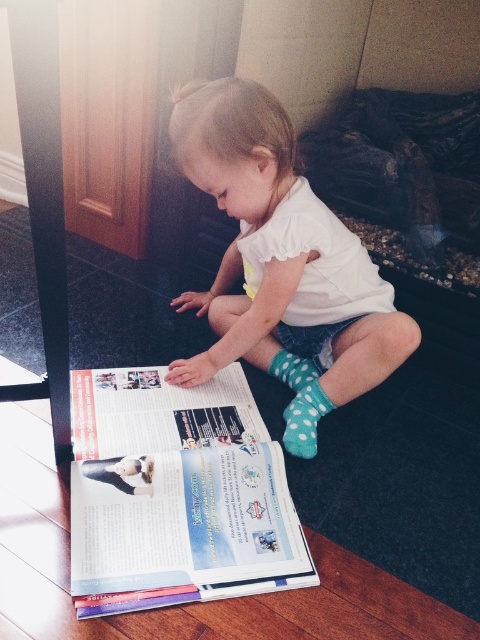
Does white glossy magazine at center have a greater height compared to polka dot fabric sock at lower center?

Yes, white glossy magazine at center is taller than polka dot fabric sock at lower center.

Is white glossy magazine at center in front of polka dot fabric sock at lower center?

That is True.

What do you see at coordinates (176, 493) in the screenshot?
I see `white glossy magazine at center` at bounding box center [176, 493].

What are the coordinates of `white glossy magazine at center` in the screenshot? It's located at click(x=176, y=493).

Between point (180, 547) and point (292, 257), which one is positioned behind?

Positioned behind is point (292, 257).

Between white glossy magazine at center and white polka dot socks at center, which one appears on the left side from the viewer's perspective?

white glossy magazine at center is more to the left.

Where is `white glossy magazine at center`? The width and height of the screenshot is (480, 640). white glossy magazine at center is located at coordinates (176, 493).

Is white polka dot socks at center below blue dotted sock at lower center?

No, white polka dot socks at center is not below blue dotted sock at lower center.

Can you confirm if white polka dot socks at center is thinner than blue dotted sock at lower center?

Incorrect, white polka dot socks at center's width is not less than blue dotted sock at lower center's.

Who is more forward, (187, 124) or (309, 400)?

Point (187, 124) is more forward.

The height and width of the screenshot is (640, 480). What are the coordinates of `white polka dot socks at center` in the screenshot? It's located at (279, 252).